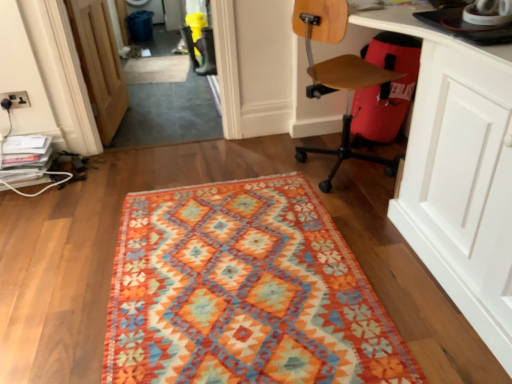
Question: Considering the relative positions of beige carpet at center and white glossy computer desk at lower right in the image provided, is beige carpet at center to the left or to the right of white glossy computer desk at lower right?

Choices:
 (A) right
 (B) left

Answer: (B)

Question: From a real-world perspective, relative to white glossy computer desk at lower right, is beige carpet at center vertically above or below?

Choices:
 (A) below
 (B) above

Answer: (A)

Question: Considering the real-world distances, which object is farthest from the wooden door at left?

Choices:
 (A) wooden at right
 (B) beige carpet at center
 (C) white glossy computer desk at lower right
 (D) matte black electric outlet at upper left
 (E) textured woolen rug at center

Answer: (C)

Question: Based on their relative distances, which object is nearer to the wooden at right?

Choices:
 (A) textured woolen rug at center
 (B) wooden door at left
 (C) white glossy computer desk at lower right
 (D) matte black electric outlet at upper left
 (E) beige carpet at center

Answer: (C)